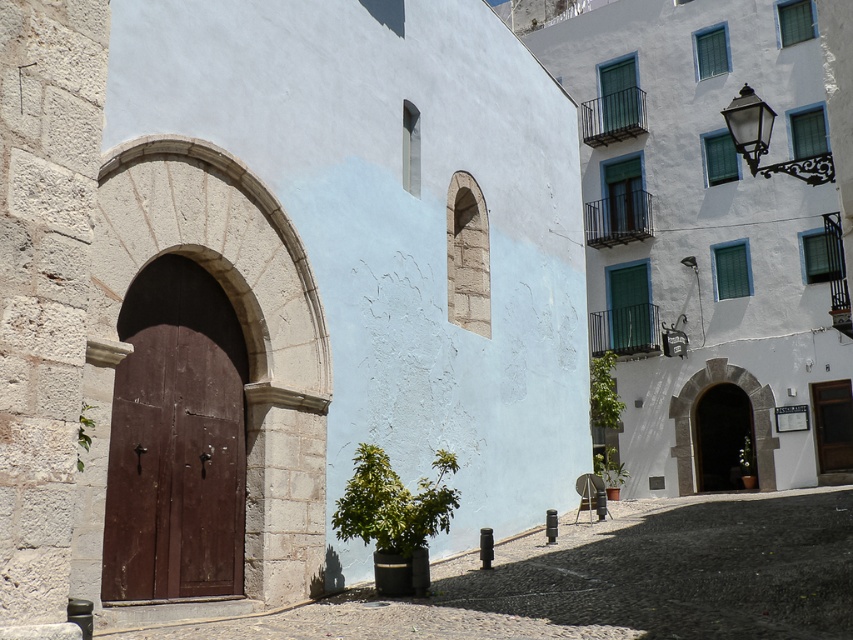
Looking at this image, which is more to the right, smooth stone alley at center or smooth white archway at center?

From the viewer's perspective, smooth white archway at center appears more on the right side.

The width and height of the screenshot is (853, 640). Describe the element at coordinates (614, 579) in the screenshot. I see `smooth stone alley at center` at that location.

Locate an element on the screen. This screenshot has height=640, width=853. smooth stone alley at center is located at coordinates (614, 579).

Is stone archway at center taller than smooth white archway at center?

Indeed, stone archway at center has a greater height compared to smooth white archway at center.

Consider the image. Does stone archway at center appear under smooth white archway at center?

Actually, stone archway at center is above smooth white archway at center.

Between point (299, 330) and point (772, 458), which one is positioned in front?

Point (299, 330)

I want to click on stone archway at center, so click(x=241, y=324).

Who is lower down, stone archway at center or brown wooden door at center?

brown wooden door at center is lower down.

Who is higher up, stone archway at center or brown wooden door at center?

stone archway at center

Between point (224, 156) and point (132, 564), which one is positioned behind?

Positioned behind is point (224, 156).

Locate an element on the screen. The width and height of the screenshot is (853, 640). stone archway at center is located at coordinates (241, 324).